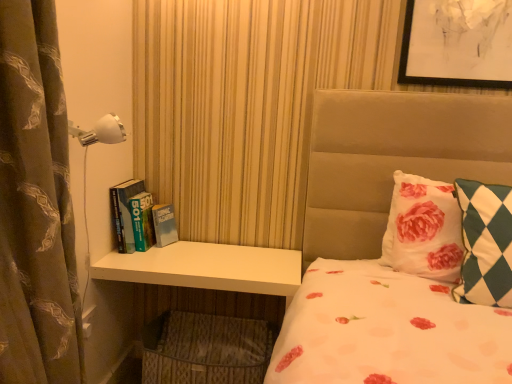
Question: Is green matte book at left shorter than brown printed fabric curtain at left?

Choices:
 (A) no
 (B) yes

Answer: (B)

Question: Considering the relative sizes of green matte book at left and brown printed fabric curtain at left in the image provided, is green matte book at left smaller than brown printed fabric curtain at left?

Choices:
 (A) no
 (B) yes

Answer: (B)

Question: Does green matte book at left have a lesser width compared to brown printed fabric curtain at left?

Choices:
 (A) no
 (B) yes

Answer: (B)

Question: Is green matte book at left surrounding brown printed fabric curtain at left?

Choices:
 (A) yes
 (B) no

Answer: (B)

Question: Is green matte book at left positioned behind brown printed fabric curtain at left?

Choices:
 (A) no
 (B) yes

Answer: (B)

Question: Could you tell me if green matte book at left is turned towards brown printed fabric curtain at left?

Choices:
 (A) yes
 (B) no

Answer: (A)

Question: From the image's perspective, would you say white floral pillow at upper right, acting as the 2th pillow starting from the front, is shown under brown printed fabric curtain at left?

Choices:
 (A) yes
 (B) no

Answer: (A)

Question: Is white floral pillow at upper right, acting as the 2th pillow starting from the front, next to brown printed fabric curtain at left?

Choices:
 (A) yes
 (B) no

Answer: (B)

Question: Is white floral pillow at upper right, acting as the 2th pillow starting from the front, behind brown printed fabric curtain at left?

Choices:
 (A) no
 (B) yes

Answer: (B)

Question: Is there a large distance between white floral pillow at upper right, marked as the first pillow in a back-to-front arrangement, and brown printed fabric curtain at left?

Choices:
 (A) yes
 (B) no

Answer: (A)

Question: Does white floral pillow at upper right, acting as the 2th pillow starting from the front, have a larger size compared to brown printed fabric curtain at left?

Choices:
 (A) yes
 (B) no

Answer: (B)

Question: Is white floral pillow at upper right, acting as the 2th pillow starting from the front, located outside brown printed fabric curtain at left?

Choices:
 (A) no
 (B) yes

Answer: (B)

Question: Does white plastic lamp at upper left have a lesser width compared to white matte dresser at lower left?

Choices:
 (A) yes
 (B) no

Answer: (A)